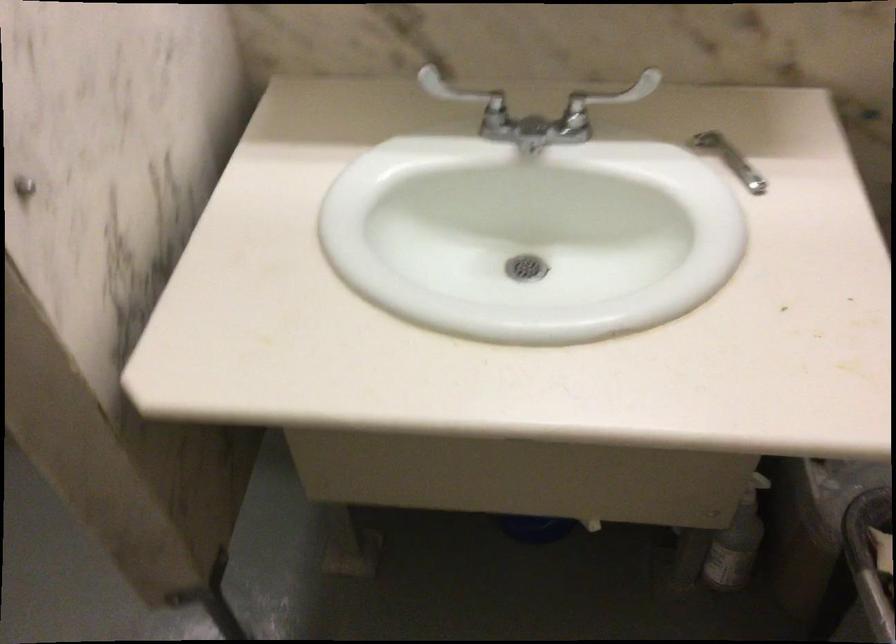
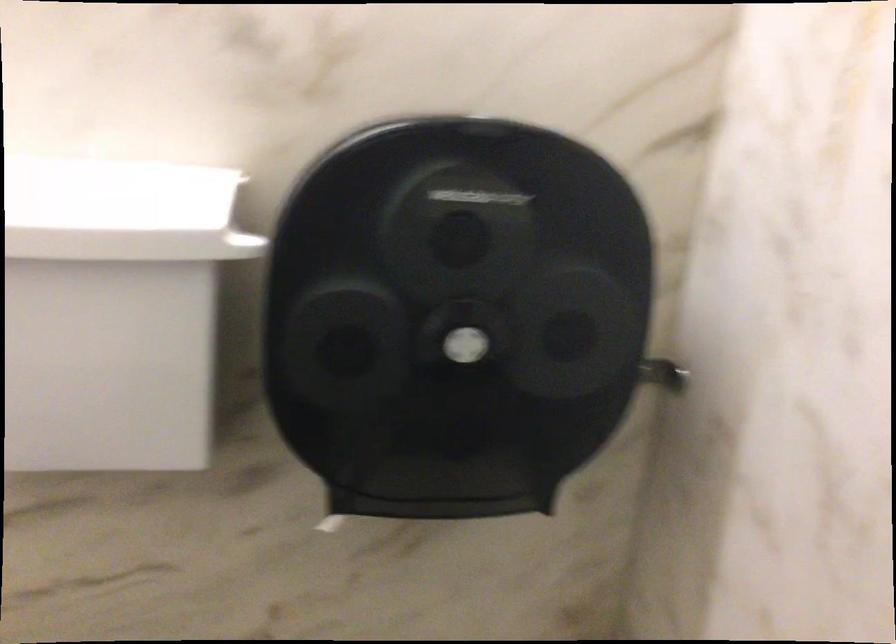
How did the camera likely rotate?

The camera's rotation is toward right-up.